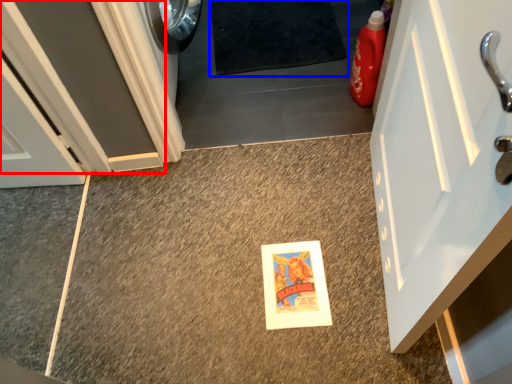
Question: Among these objects, which one is farthest to the camera, door (highlighted by a red box) or bath mat (highlighted by a blue box)?

Choices:
 (A) door
 (B) bath mat

Answer: (B)